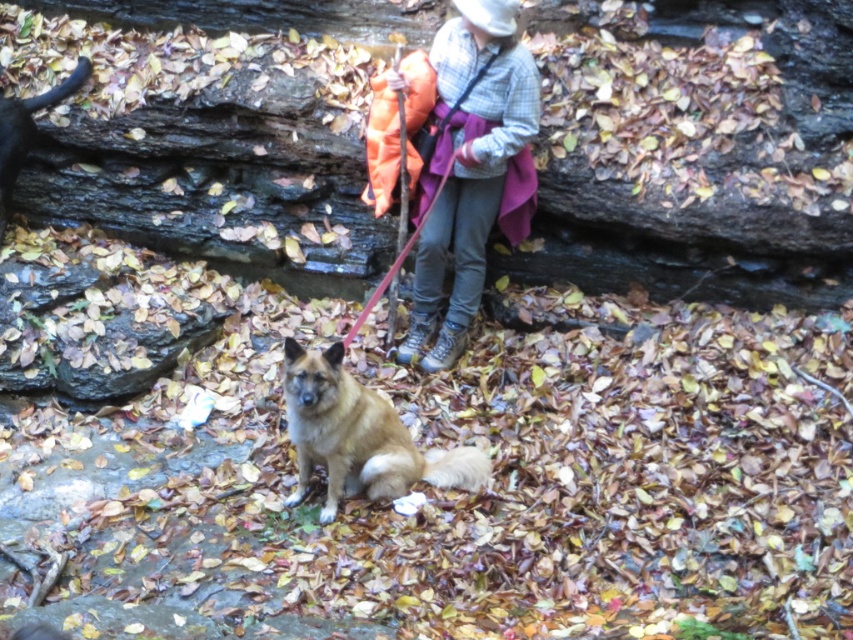
Question: Is plaid flannel shirt at upper center to the right of brown fur dog at center from the viewer's perspective?

Choices:
 (A) no
 (B) yes

Answer: (B)

Question: Can you confirm if plaid flannel shirt at upper center is thinner than brown fur dog at center?

Choices:
 (A) yes
 (B) no

Answer: (A)

Question: Which of the following is the farthest from the observer?

Choices:
 (A) brown fur dog at center
 (B) plaid flannel shirt at upper center

Answer: (B)

Question: Which point is farther to the camera?

Choices:
 (A) plaid flannel shirt at upper center
 (B) brown fur dog at center

Answer: (A)

Question: Is plaid flannel shirt at upper center positioned before brown fur dog at center?

Choices:
 (A) yes
 (B) no

Answer: (B)